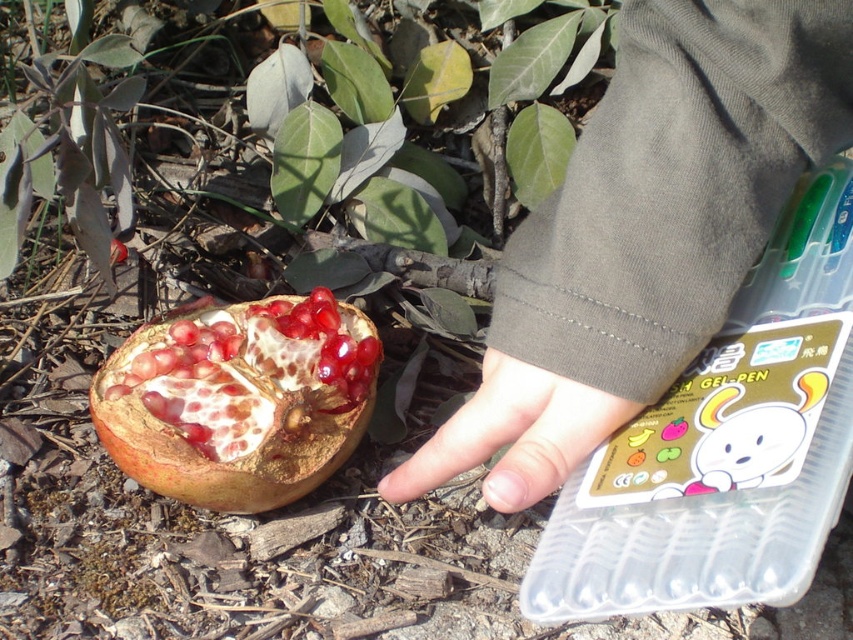
Describe the element at coordinates (643, 232) in the screenshot. The height and width of the screenshot is (640, 853). I see `dark gray fabric at upper right` at that location.

Is dark gray fabric at upper right shorter than shiny red pomegranate at lower left?

No, dark gray fabric at upper right is not shorter than shiny red pomegranate at lower left.

Between point (683, 81) and point (132, 358), which one is positioned in front?

Point (683, 81) is in front.

Find the location of a particular element. The width and height of the screenshot is (853, 640). dark gray fabric at upper right is located at coordinates (643, 232).

Who is more distant from viewer, (247, 358) or (529, 500)?

Positioned behind is point (247, 358).

Between shiny red pomegranate at lower left and smooth skin hand at center, which one appears on the right side from the viewer's perspective?

Positioned to the right is smooth skin hand at center.

Where is `shiny red pomegranate at lower left`? The width and height of the screenshot is (853, 640). shiny red pomegranate at lower left is located at coordinates (238, 400).

Looking at this image, who is positioned more to the left, dark gray fabric at upper right or smooth skin hand at center?

From the viewer's perspective, smooth skin hand at center appears more on the left side.

Is point (662, 173) behind point (415, 452)?

No.

Where is `dark gray fabric at upper right`? dark gray fabric at upper right is located at coordinates (643, 232).